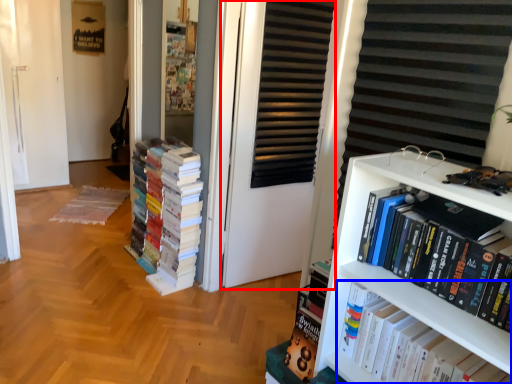
Question: Among these objects, which one is farthest to the camera, screen door (highlighted by a red box) or book (highlighted by a blue box)?

Choices:
 (A) screen door
 (B) book

Answer: (A)